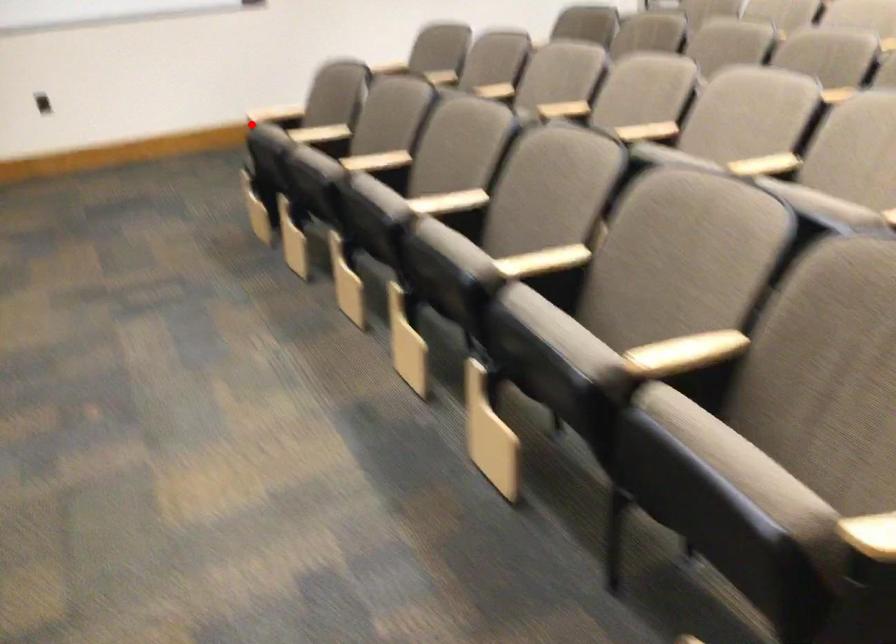
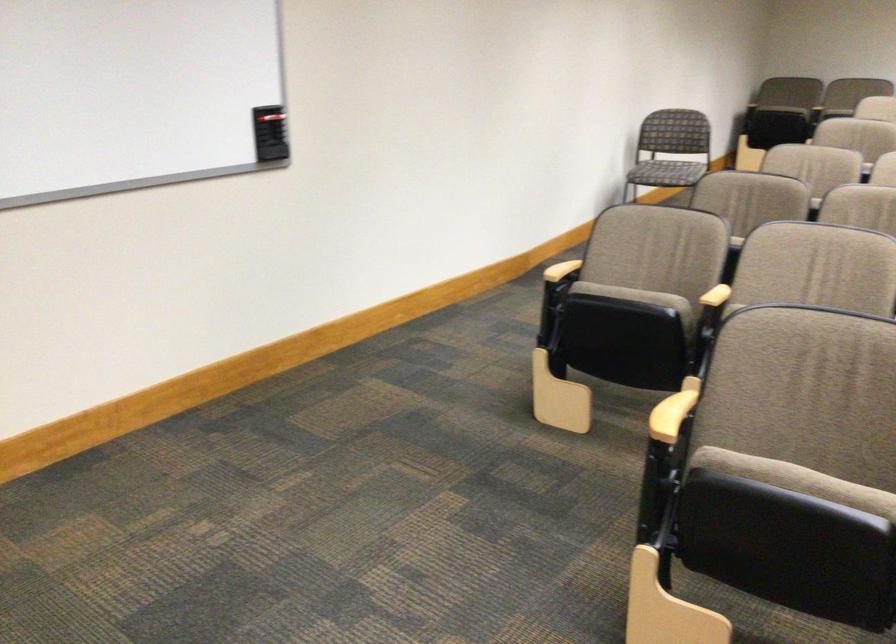
In the second image, find the point that corresponds to the highlighted location in the first image.

(796, 480)